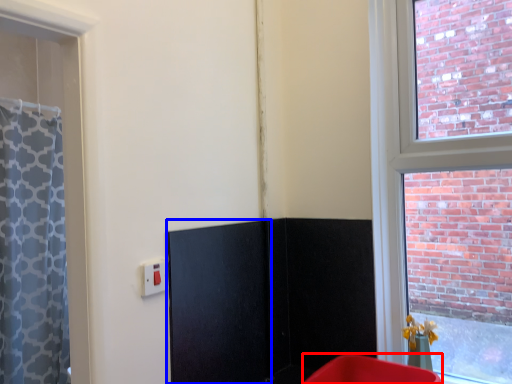
Question: Among these objects, which one is nearest to the camera, furniture (highlighted by a red box) or screen door (highlighted by a blue box)?

Choices:
 (A) furniture
 (B) screen door

Answer: (A)